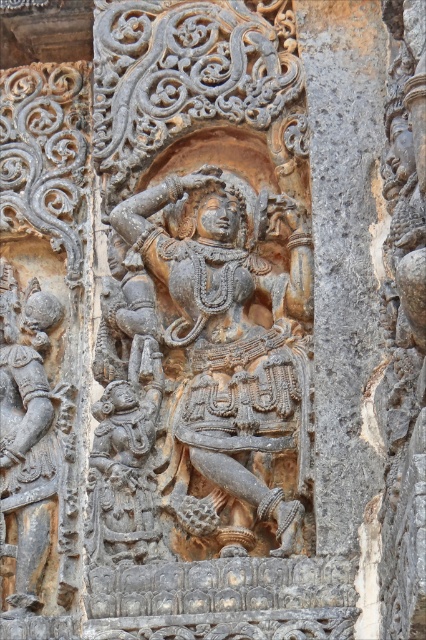
Does carved stone dancer at center appear over gray stone warrior at left?

Indeed, carved stone dancer at center is positioned over gray stone warrior at left.

Can you confirm if carved stone dancer at center is positioned below gray stone warrior at left?

Incorrect, carved stone dancer at center is not positioned below gray stone warrior at left.

Is point (267, 276) positioned after point (28, 509)?

No.

Identify the location of carved stone dancer at center. This screenshot has height=640, width=426. (222, 339).

Between point (290, 477) and point (350, 435), which one is positioned in front?

Point (350, 435) is more forward.

Does point (256, 253) come in front of point (317, 179)?

That is False.

You are a GUI agent. You are given a task and a screenshot of the screen. Output one action in this format:
    pyautogui.click(x=<x>, y=<y>)
    Task: Click on the carved stone dancer at center
    This screenshot has height=640, width=426.
    Given the screenshot: What is the action you would take?
    pyautogui.click(x=222, y=339)

The image size is (426, 640). Find the location of `carved stone dancer at center`. carved stone dancer at center is located at coordinates (222, 339).

Is point (331, 154) positioned before point (11, 444)?

Yes, it is.

Is gray stone pillar at center taller than gray stone warrior at left?

Correct, gray stone pillar at center is much taller as gray stone warrior at left.

Does point (351, 460) lie behind point (26, 364)?

No, it is in front of (26, 364).

Where is `gray stone pillar at center`? This screenshot has width=426, height=640. gray stone pillar at center is located at coordinates (342, 252).